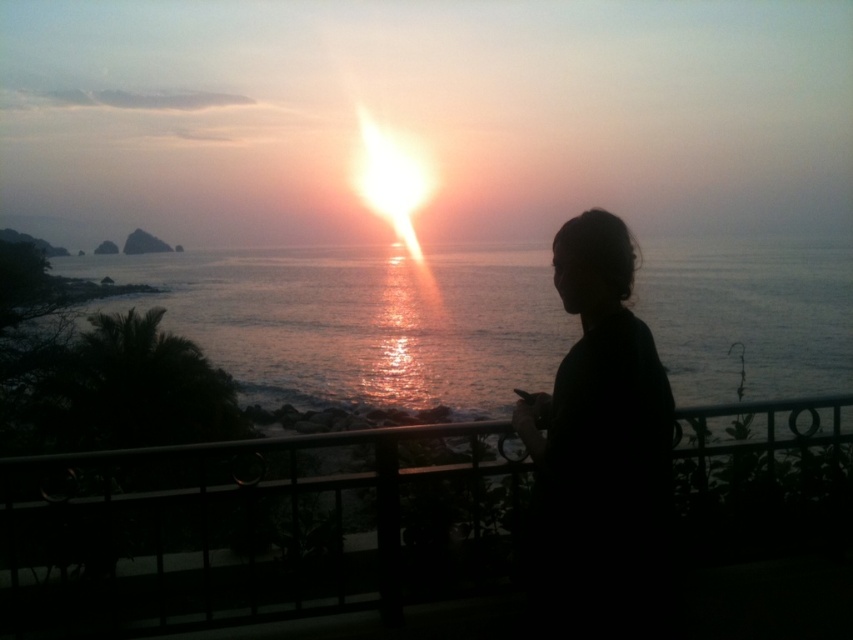
Question: Is black metal railing at center below black matte hair at center?

Choices:
 (A) yes
 (B) no

Answer: (A)

Question: Does black metal railing at center have a lesser width compared to black matte hair at center?

Choices:
 (A) yes
 (B) no

Answer: (B)

Question: Which object appears farthest from the camera in this image?

Choices:
 (A) black metal railing at center
 (B) black matte hair at center

Answer: (A)

Question: Is black metal railing at center thinner than black matte hair at center?

Choices:
 (A) no
 (B) yes

Answer: (A)